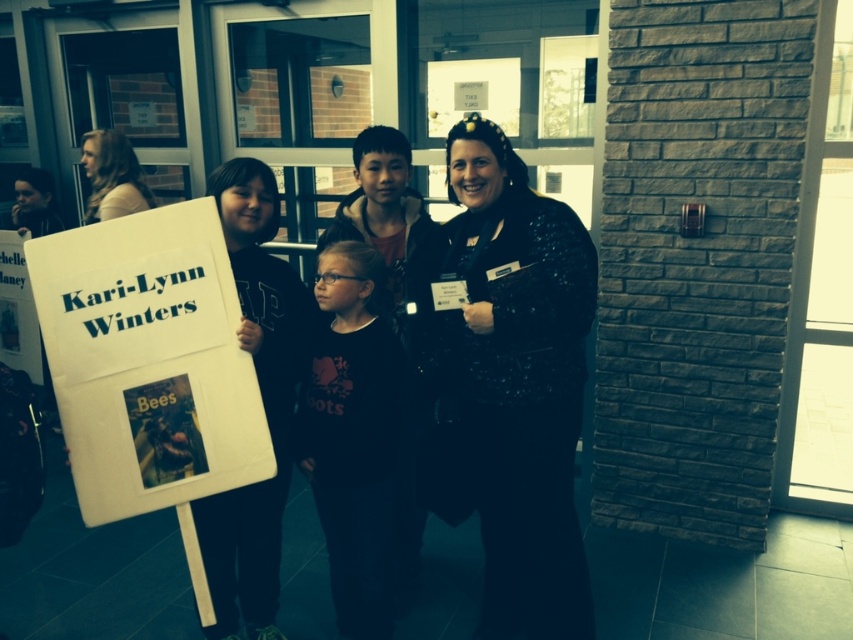
Question: Which object is closer to the camera taking this photo?

Choices:
 (A) matte black jacket at center
 (B) white paper at center

Answer: (A)

Question: Is black sequined sweater at center smaller than matte black jacket at center?

Choices:
 (A) yes
 (B) no

Answer: (B)

Question: Does white paper at center have a larger size compared to blonde hair at upper left?

Choices:
 (A) no
 (B) yes

Answer: (B)

Question: Can you confirm if black sequined sweater at center is smaller than white paper at center?

Choices:
 (A) yes
 (B) no

Answer: (B)

Question: Which point is closer to the camera taking this photo?

Choices:
 (A) (584, 609)
 (B) (26, 301)
 (C) (292, 346)

Answer: (C)

Question: Which of the following is the closest to the observer?

Choices:
 (A) (563, 436)
 (B) (97, 147)
 (C) (297, 371)

Answer: (A)